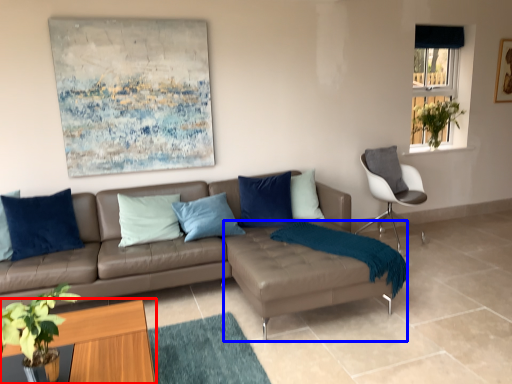
Question: Among these objects, which one is nearest to the camera, coffee table (highlighted by a red box) or footrest (highlighted by a blue box)?

Choices:
 (A) coffee table
 (B) footrest

Answer: (A)